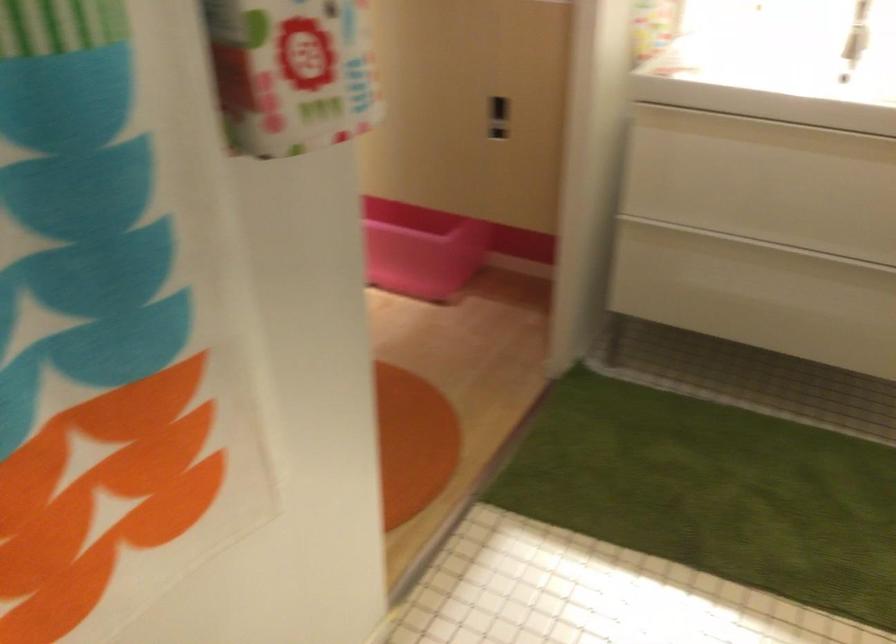
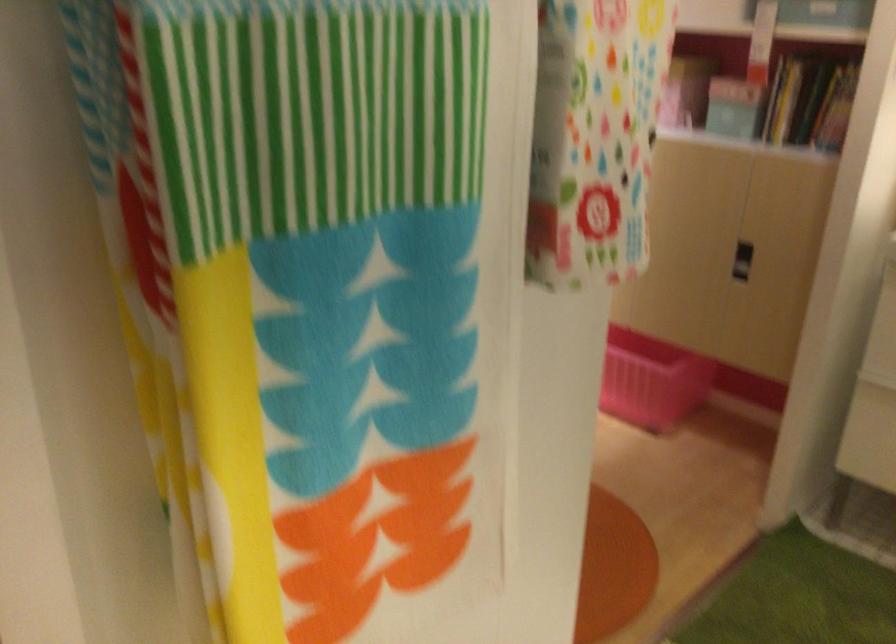
Question: The camera is either moving clockwise (left) or counter-clockwise (right) around the object. The first image is from the beginning of the video and the second image is from the end. Is the camera moving left or right when shooting the video?

Choices:
 (A) Left
 (B) Right

Answer: (B)